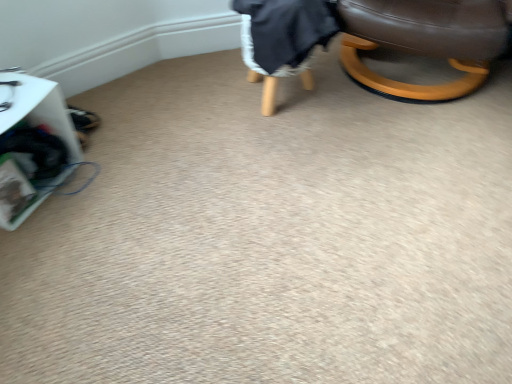
Question: Is brown leather chair at upper right at the right side of white plastic basket at left?

Choices:
 (A) no
 (B) yes

Answer: (B)

Question: Is brown leather chair at upper right oriented away from white plastic basket at left?

Choices:
 (A) no
 (B) yes

Answer: (A)

Question: Is white plastic basket at left inside brown leather chair at upper right?

Choices:
 (A) yes
 (B) no

Answer: (B)

Question: Is brown leather chair at upper right thinner than white plastic basket at left?

Choices:
 (A) yes
 (B) no

Answer: (B)

Question: Is brown leather chair at upper right positioned beyond the bounds of white plastic basket at left?

Choices:
 (A) no
 (B) yes

Answer: (B)

Question: Is brown leather chair at upper right in front of white plastic basket at left?

Choices:
 (A) no
 (B) yes

Answer: (A)

Question: Is dark gray fabric bean bag chair at upper right smaller than white plastic basket at left?

Choices:
 (A) yes
 (B) no

Answer: (B)

Question: Is dark gray fabric bean bag chair at upper right directly adjacent to white plastic basket at left?

Choices:
 (A) yes
 (B) no

Answer: (B)

Question: From a real-world perspective, is dark gray fabric bean bag chair at upper right on white plastic basket at left?

Choices:
 (A) yes
 (B) no

Answer: (A)

Question: Does dark gray fabric bean bag chair at upper right have a greater width compared to white plastic basket at left?

Choices:
 (A) no
 (B) yes

Answer: (B)

Question: Considering the relative sizes of dark gray fabric bean bag chair at upper right and white plastic basket at left in the image provided, is dark gray fabric bean bag chair at upper right bigger than white plastic basket at left?

Choices:
 (A) no
 (B) yes

Answer: (B)

Question: Does dark gray fabric bean bag chair at upper right appear on the left side of white plastic basket at left?

Choices:
 (A) yes
 (B) no

Answer: (B)

Question: Is brown leather chair at upper right beside dark gray fabric bean bag chair at upper right?

Choices:
 (A) no
 (B) yes

Answer: (A)